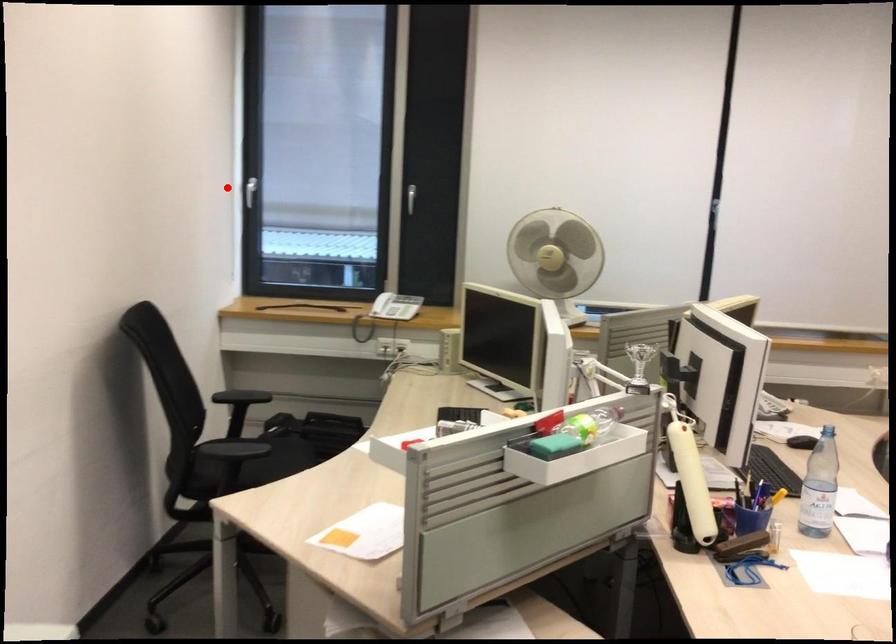
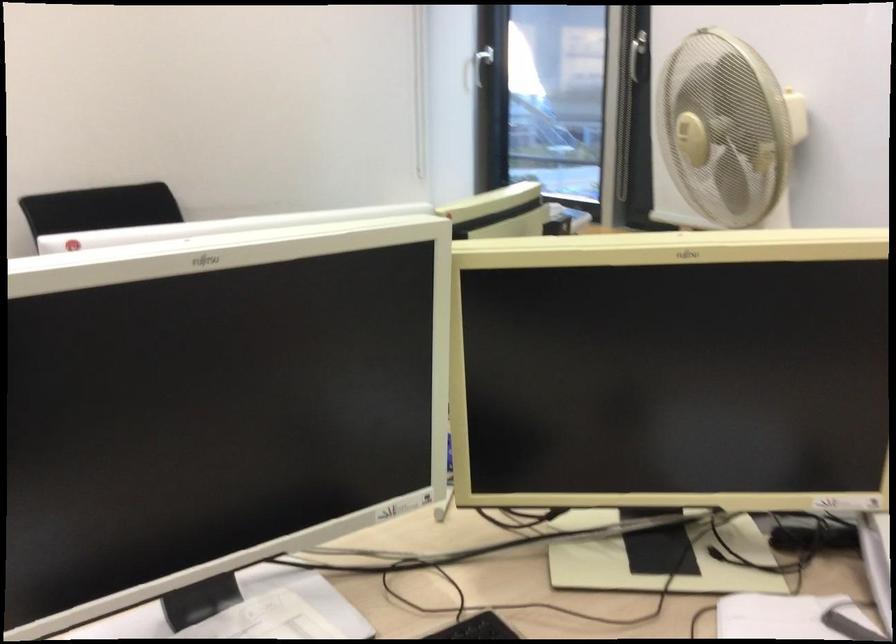
Question: I am providing you with two images of the same scene from different viewpoints. Image1 has a red point marked. In image2, the corresponding 3D location appears at what relative position? Reply with the corresponding letter.

Choices:
 (A) Closer
 (B) Farther

Answer: (A)